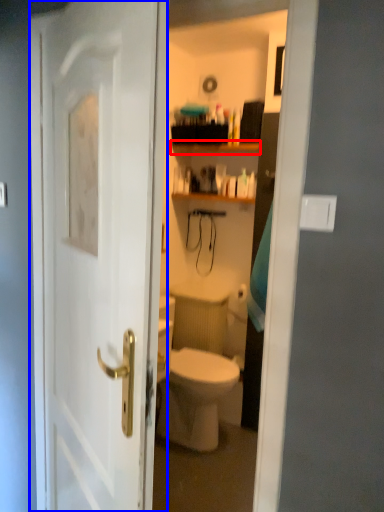
Question: Which object appears closest to the camera in this image, shelf (highlighted by a red box) or door (highlighted by a blue box)?

Choices:
 (A) shelf
 (B) door

Answer: (B)